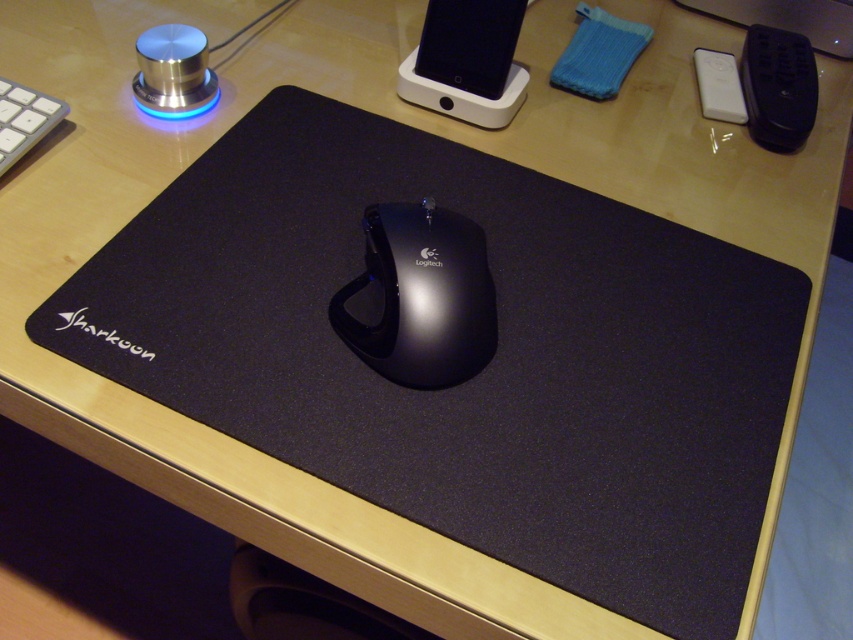
You are setting up a new desk and want to place both the black glossy mouse at center and the white plastic keyboard at upper left. Given their sizes, which one should you place first to ensure they both fit on the desk?

The black glossy mouse at center is bigger than the white plastic keyboard at upper left. You should place the black glossy mouse at center first to ensure there is enough space for both items.

Looking at this image, you are setting up a new desk and want to ensure proper ergonomics. Considering the black glossy mouse at center and the white plastic keyboard at upper left, which object is positioned higher in terms of vertical height?

The black glossy mouse at center is taller than the white plastic keyboard at upper left, so it is positioned higher vertically.